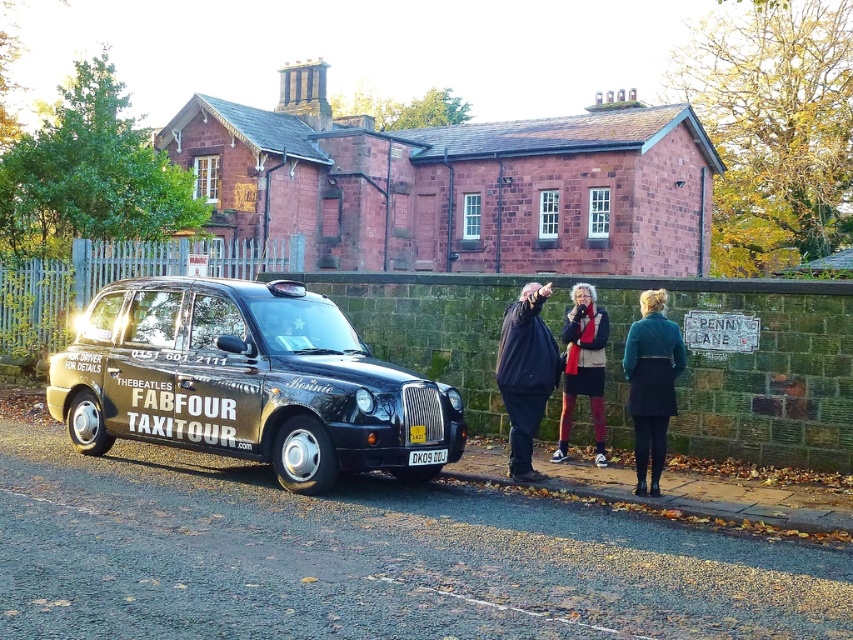
Describe the element at coordinates (247, 381) in the screenshot. This screenshot has height=640, width=853. I see `black metallic taxi at lower left` at that location.

Does black metallic taxi at lower left come behind teal wool coat at lower right?

No, black metallic taxi at lower left is in front of teal wool coat at lower right.

Measure the distance between point (207, 428) and camera.

Point (207, 428) and camera are 8.93 meters apart.

Locate an element on the screen. The image size is (853, 640). black metallic taxi at lower left is located at coordinates (247, 381).

Measure the distance between black metallic taxi at lower left and black plastic license plate at center.

black metallic taxi at lower left is 5.47 feet away from black plastic license plate at center.

Which is in front, point (173, 324) or point (437, 449)?

Point (437, 449) is in front.

Image resolution: width=853 pixels, height=640 pixels. I want to click on black metallic taxi at lower left, so point(247,381).

Who is shorter, black metallic taxi at lower left or velvet red scarf at center?

With less height is velvet red scarf at center.

From the picture: Is black metallic taxi at lower left above velvet red scarf at center?

Indeed, black metallic taxi at lower left is positioned over velvet red scarf at center.

Locate an element on the screen. This screenshot has width=853, height=640. black metallic taxi at lower left is located at coordinates (247, 381).

This screenshot has height=640, width=853. I want to click on black metallic taxi at lower left, so click(x=247, y=381).